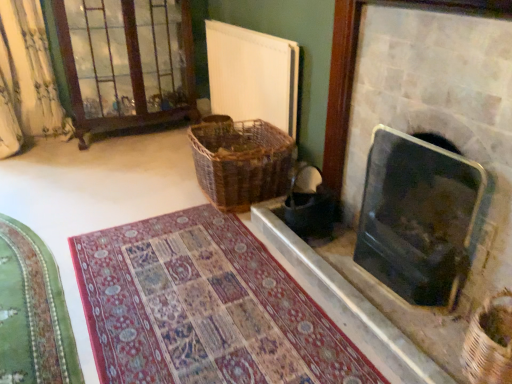
Locate an element on the screen. vacant space in front of brown wooden glass door at upper left is located at coordinates (116, 165).